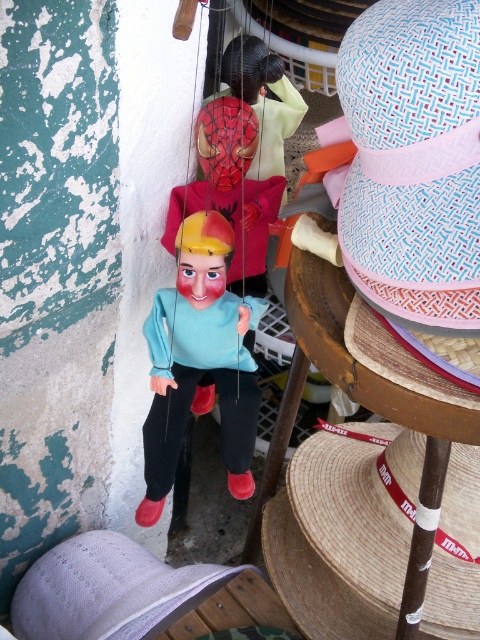
Is point (90, 620) closer to camera compared to point (250, 154)?

That is False.

How much distance is there between lavender woven straw hat at lower left and matte plastic puppet at center?

lavender woven straw hat at lower left is 32.43 inches away from matte plastic puppet at center.

Identify the location of lavender woven straw hat at lower left. (108, 589).

Is point (154, 451) less distant than point (216, 118)?

No.

Identify the location of matte plastic doll at center. Image resolution: width=480 pixels, height=640 pixels. (199, 360).

Does straw hat at lower right have a lesser width compared to lavender woven straw hat at lower left?

Yes.

Looking at this image, is straw hat at lower right closer to camera compared to lavender woven straw hat at lower left?

Yes, straw hat at lower right is in front of lavender woven straw hat at lower left.

Which is in front, point (477, 524) or point (145, 556)?

Positioned in front is point (477, 524).

Locate an element on the screen. This screenshot has width=480, height=640. straw hat at lower right is located at coordinates (360, 504).